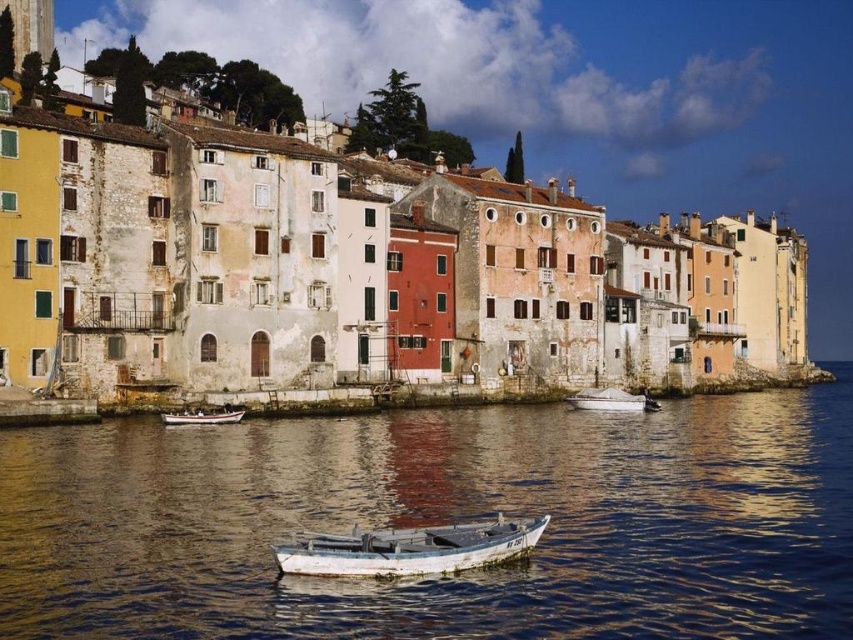
Image resolution: width=853 pixels, height=640 pixels. In order to click on white wooden boat at lower center in this screenshot , I will do `click(409, 548)`.

Identify the location of white wooden boat at lower center. (409, 548).

Does white matte boat at center have a lesser height compared to white wooden boat at center?

No.

Based on the photo, can you confirm if white matte boat at center is taller than white wooden boat at center?

Yes.

Is point (630, 406) closer to camera compared to point (200, 413)?

No, (630, 406) is behind (200, 413).

Locate an element on the screen. The width and height of the screenshot is (853, 640). white matte boat at center is located at coordinates point(608,401).

Can you confirm if smooth water at center is positioned to the left of white wooden boat at center?

In fact, smooth water at center is to the right of white wooden boat at center.

Can you confirm if smooth water at center is positioned below white wooden boat at center?

Yes.

Does point (624, 461) come farther from viewer compared to point (212, 416)?

That is False.

Image resolution: width=853 pixels, height=640 pixels. In order to click on smooth water at center in this screenshot , I will do `click(440, 520)`.